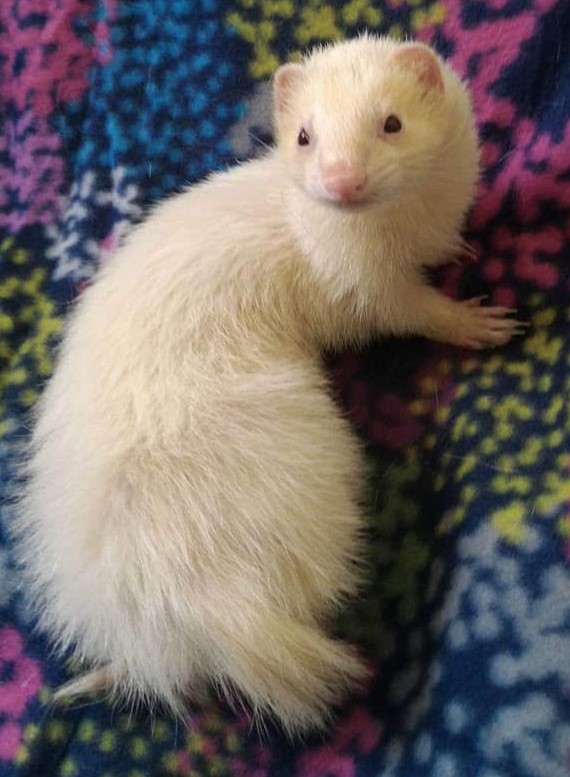
You are a GUI agent. You are given a task and a screenshot of the screen. Output one action in this format:
    pyautogui.click(x=<x>, y=<y>)
    Task: Click on the white fur
    The width and height of the screenshot is (570, 777).
    Given the screenshot: What is the action you would take?
    pyautogui.click(x=177, y=416), pyautogui.click(x=243, y=267)